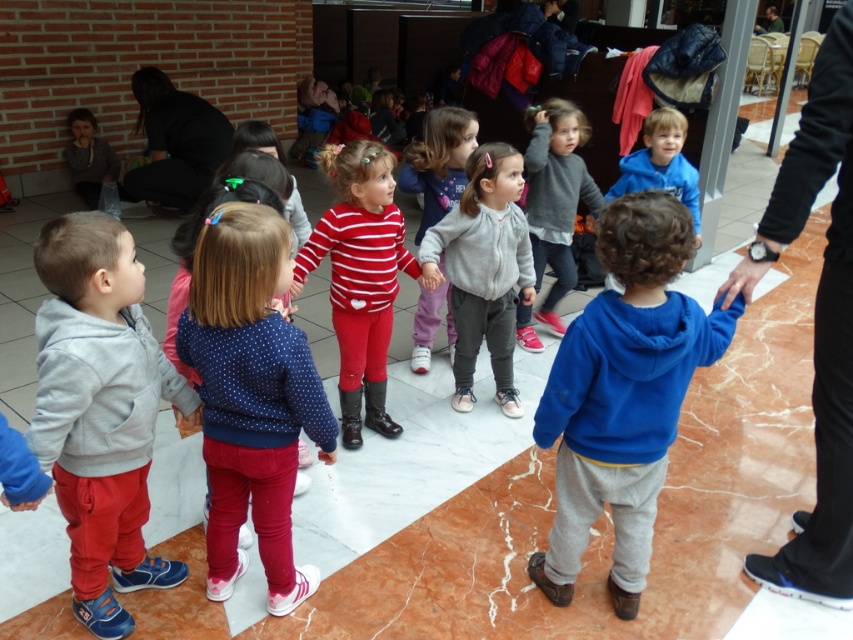
Question: Does striped cotton sweater at center have a greater width compared to gray fleece jacket at center?

Choices:
 (A) no
 (B) yes

Answer: (A)

Question: Which of the following is the farthest from the observer?

Choices:
 (A) (201, 298)
 (B) (142, 412)
 (C) (357, 280)
 (D) (639, 515)

Answer: (C)

Question: Estimate the real-world distances between objects in this image. Which object is closer to the matte gray hoodie at left?

Choices:
 (A) gray fleece jacket at center
 (B) striped fabric dress at center
 (C) striped cotton sweater at center
 (D) blue dotted sweater at center

Answer: (D)

Question: Can you confirm if blue fleece sweatshirt at center is positioned to the right of gray fleece jacket at center?

Choices:
 (A) no
 (B) yes

Answer: (B)

Question: Is matte gray hoodie at left below striped cotton sweater at center?

Choices:
 (A) no
 (B) yes

Answer: (B)

Question: Based on their relative distances, which object is nearer to the blue fleece sweatshirt at center?

Choices:
 (A) matte gray hoodie at left
 (B) gray fleece jacket at center

Answer: (B)